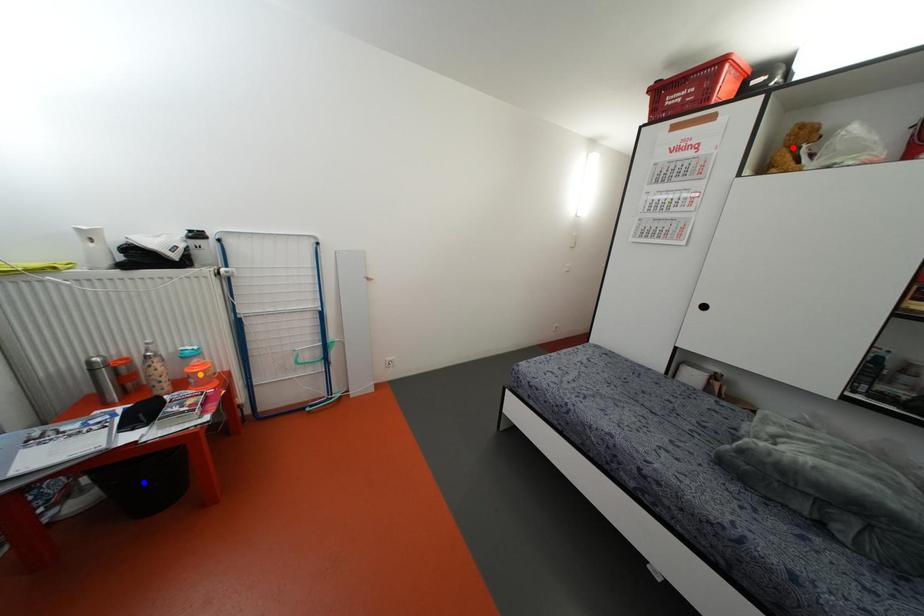
Order these from nearest to farthest:
1. blue point
2. red point
3. orange point

blue point, red point, orange point